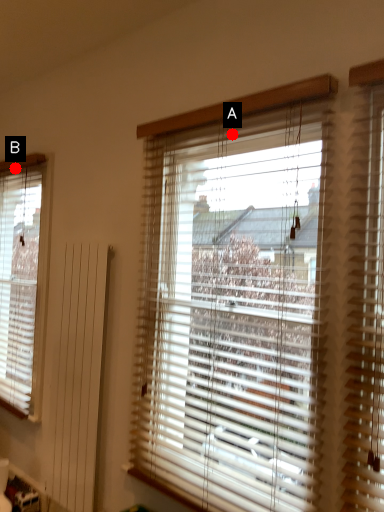
Question: Two points are circled on the image, labeled by A and B beside each circle. Which point is farther from the camera taking this photo?

Choices:
 (A) A is further
 (B) B is further

Answer: (B)